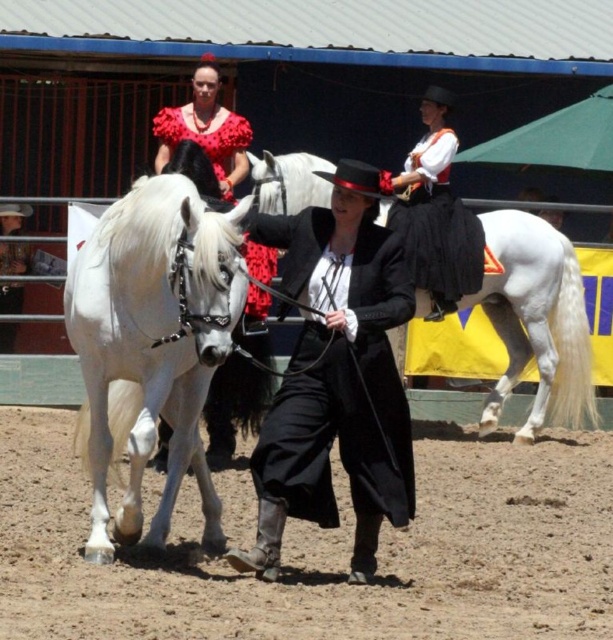
Based on the scene described, which object is taller between the white glossy horse at left and the floral fabric dress at upper center?

The white glossy horse at left is much taller than the floral fabric dress at upper center.

Looking at this image, you are standing at the starting line of the equestrian arena. You see two points marked in the background. Which point is closer to you, point (x=150, y=243) or point (x=249, y=132)?

Point (x=150, y=243) is in front of point (x=249, y=132), so it is closer to you.